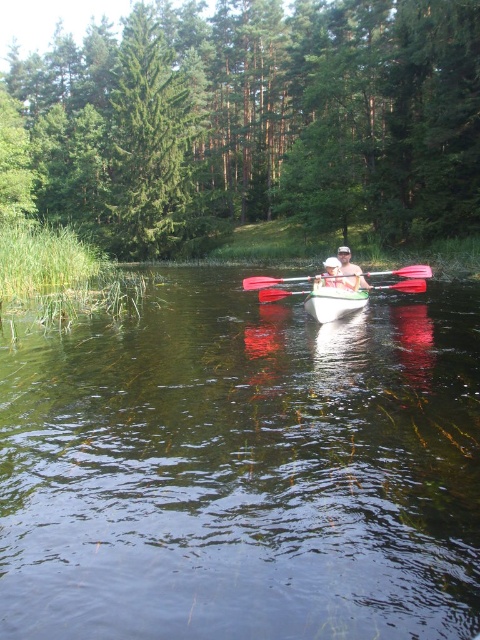
From the picture: You are standing on the shore of the lake and want to retrieve the matte black paddle at center from the green plastic kayak at center. Given that the kayak is 21.48 feet away from you, can you reach it without getting into the water?

The green plastic kayak at center is 21.48 feet away from the matte black paddle at center. Since the kayak is 21.48 feet away from you, you would need to either swim or use a long tool to reach the paddle, as it is beyond typical arm reach.

You are standing on the shore of the lake and see two points in the water. The first point is at coordinates point (356, 298) and the second is at point (243, 280). Which point is closer to you?

Point (356, 298) is closer to the viewer than point (243, 280).

You are standing on the shore looking at the green glossy tree at upper left and the matte white kayak at center. Which object is positioned to the left of the other?

The green glossy tree at upper left is positioned to the left of the matte white kayak at center.